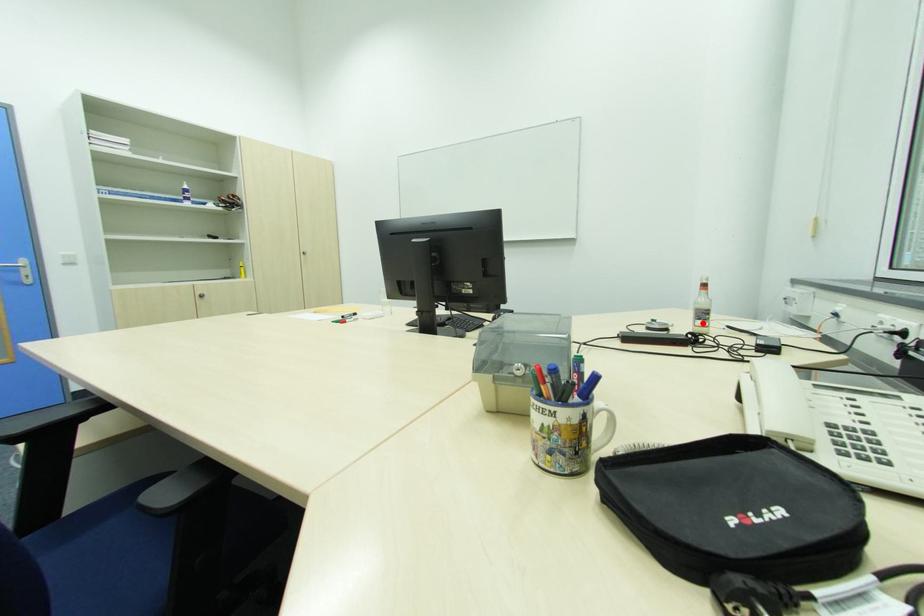
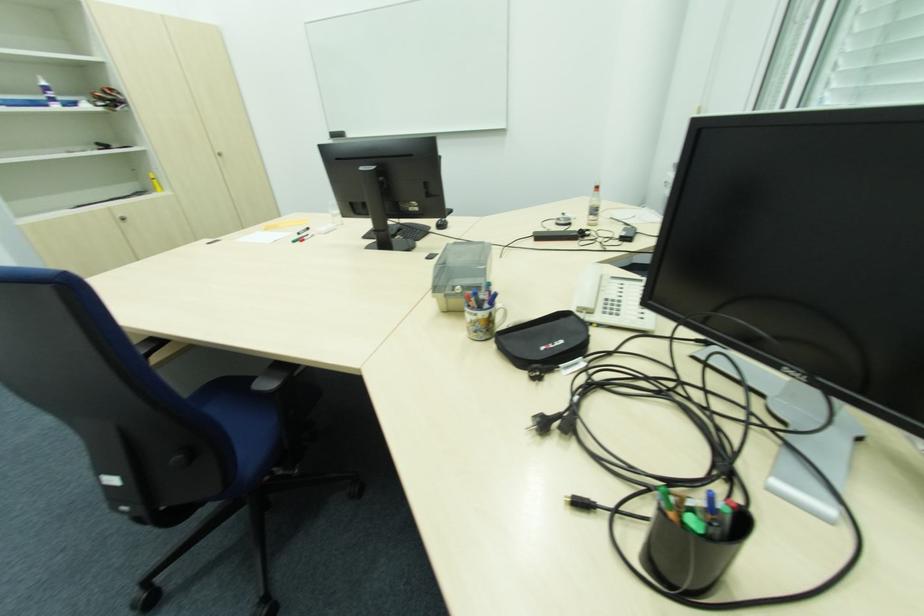
Question: I am providing you with two images of the same scene from different viewpoints. A red point is marked on the first image. Is the red point's position out of view in image 2?

Choices:
 (A) Yes
 (B) No

Answer: (B)